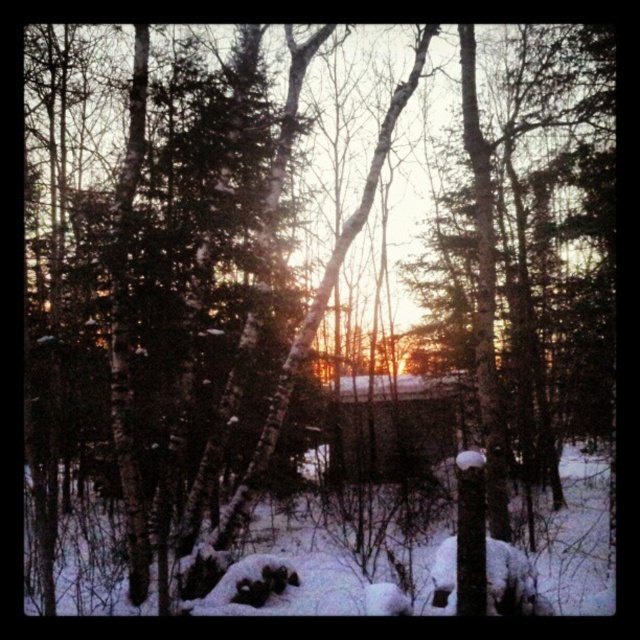
You are standing in the winter forest scene and want to take a photo of the brown wooden cabin at center. Where should you position yourself relative to the white fluffy snow at center to ensure the cabin is fully visible in the frame?

To ensure the brown wooden cabin at center is fully visible in the frame, you should position yourself above the white fluffy snow at center since the cabin is located above it.